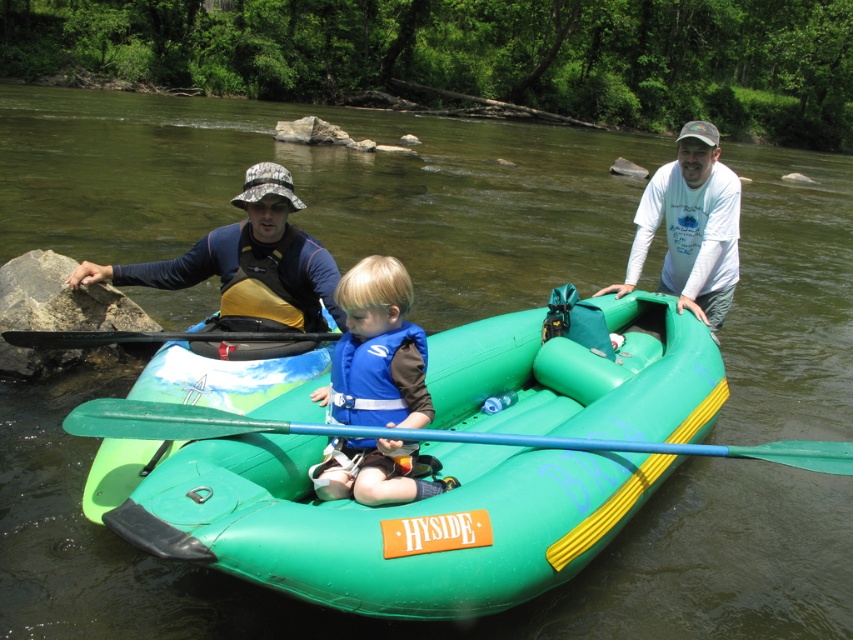
Consider the image. You are planning to pack your backpack for a day of river activities. You have both the blue fabric life vest at center and the green plastic paddle at center. Which item should you place first into your backpack to ensure the thicker item is on top for easier access?

The green plastic paddle at center is thicker than the blue fabric life vest at center, so you should place the green plastic paddle at center first into your backpack so that the thicker item is on top for easier access.

You are planning to take a photo of the white long sleeved shirt at upper right while standing at point [689,227]. Is the white long sleeved shirt at upper right visible from your current position?

The point [689,227] is where the white long sleeved shirt at upper right is located, so yes, you can see the white long sleeved shirt at upper right from that position.